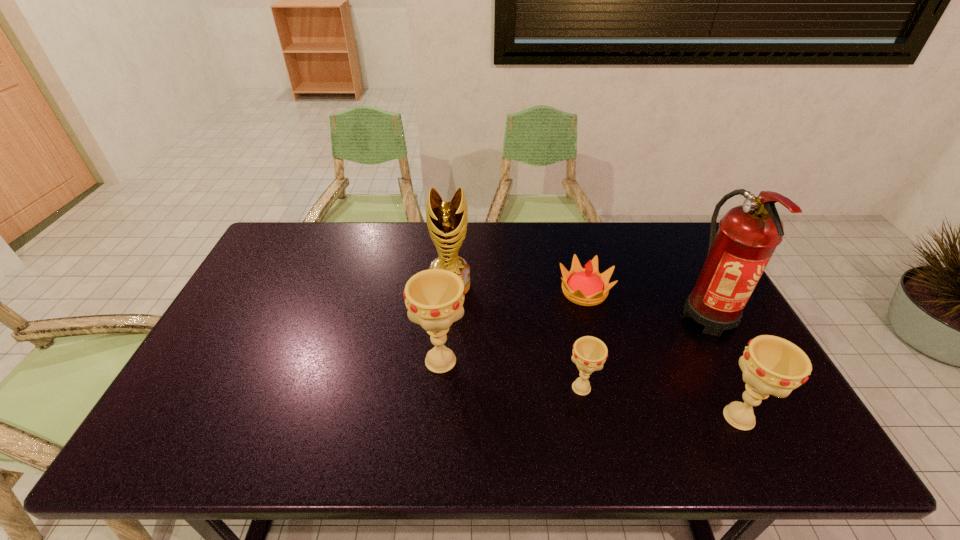
Locate which object ranks third in proximity to the second chalice from right to left. Please provide its 2D coordinates. Your answer should be formatted as a tuple, i.e. [(x, y)], where the tuple contains the x and y coordinates of a point satisfying the conditions above.

[(771, 365)]

I want to click on chalice that is the second closest one to the tallest object, so click(x=589, y=353).

Point out which chalice is positioned as the third nearest to the fire extinguisher. Please provide its 2D coordinates. Your answer should be formatted as a tuple, i.e. [(x, y)], where the tuple contains the x and y coordinates of a point satisfying the conditions above.

[(434, 298)]

This screenshot has width=960, height=540. I want to click on vacant space that satisfies the following two spatial constraints: 1. on the front-facing side of the award; 2. on the left side of the second shortest object, so (443, 388).

Where is `free point that satisfies the following two spatial constraints: 1. on the front-facing side of the second shortest chalice; 2. on the right side of the second tallest object`? The width and height of the screenshot is (960, 540). free point that satisfies the following two spatial constraints: 1. on the front-facing side of the second shortest chalice; 2. on the right side of the second tallest object is located at coordinates [x=441, y=417].